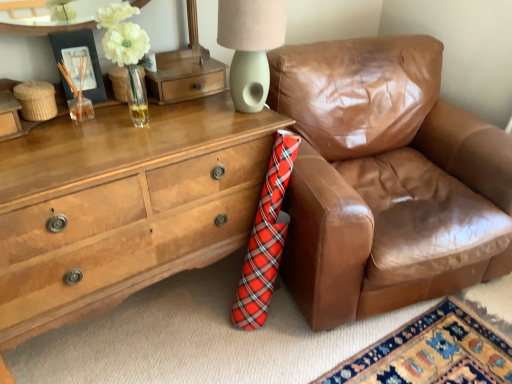
Question: Is matte black picture frame at upper left thinner than wooden chest of drawers at lower left?

Choices:
 (A) no
 (B) yes

Answer: (B)

Question: Is matte black picture frame at upper left taller than wooden chest of drawers at lower left?

Choices:
 (A) no
 (B) yes

Answer: (A)

Question: From a real-world perspective, is matte black picture frame at upper left positioned over wooden chest of drawers at lower left based on gravity?

Choices:
 (A) yes
 (B) no

Answer: (A)

Question: Is wooden chest of drawers at lower left completely or partially inside matte black picture frame at upper left?

Choices:
 (A) no
 (B) yes

Answer: (A)

Question: Considering the relative sizes of matte black picture frame at upper left and wooden chest of drawers at lower left in the image provided, is matte black picture frame at upper left bigger than wooden chest of drawers at lower left?

Choices:
 (A) no
 (B) yes

Answer: (A)

Question: Is matte black picture frame at upper left to the left or to the right of wooden chest of drawers at lower left in the image?

Choices:
 (A) right
 (B) left

Answer: (B)

Question: Would you say matte black picture frame at upper left is inside or outside wooden chest of drawers at lower left?

Choices:
 (A) outside
 (B) inside

Answer: (A)

Question: In the image, is matte black picture frame at upper left positioned in front of or behind wooden chest of drawers at lower left?

Choices:
 (A) front
 (B) behind

Answer: (B)

Question: Is matte black picture frame at upper left taller or shorter than wooden chest of drawers at lower left?

Choices:
 (A) tall
 (B) short

Answer: (B)

Question: Does point (95, 51) appear closer or farther from the camera than point (406, 109)?

Choices:
 (A) closer
 (B) farther

Answer: (A)

Question: From a real-world perspective, is matte black picture frame at upper left positioned above or below brown leather chair at right?

Choices:
 (A) below
 (B) above

Answer: (B)

Question: Considering the positions of matte black picture frame at upper left and brown leather chair at right in the image, is matte black picture frame at upper left taller or shorter than brown leather chair at right?

Choices:
 (A) short
 (B) tall

Answer: (A)

Question: In the image, is matte black picture frame at upper left positioned in front of or behind brown leather chair at right?

Choices:
 (A) behind
 (B) front

Answer: (A)

Question: Looking at their shapes, would you say matte green ceramic lampshade at upper center is wider or thinner than wooden chest of drawers at lower left?

Choices:
 (A) wide
 (B) thin

Answer: (B)

Question: Would you say matte green ceramic lampshade at upper center is inside or outside wooden chest of drawers at lower left?

Choices:
 (A) inside
 (B) outside

Answer: (B)